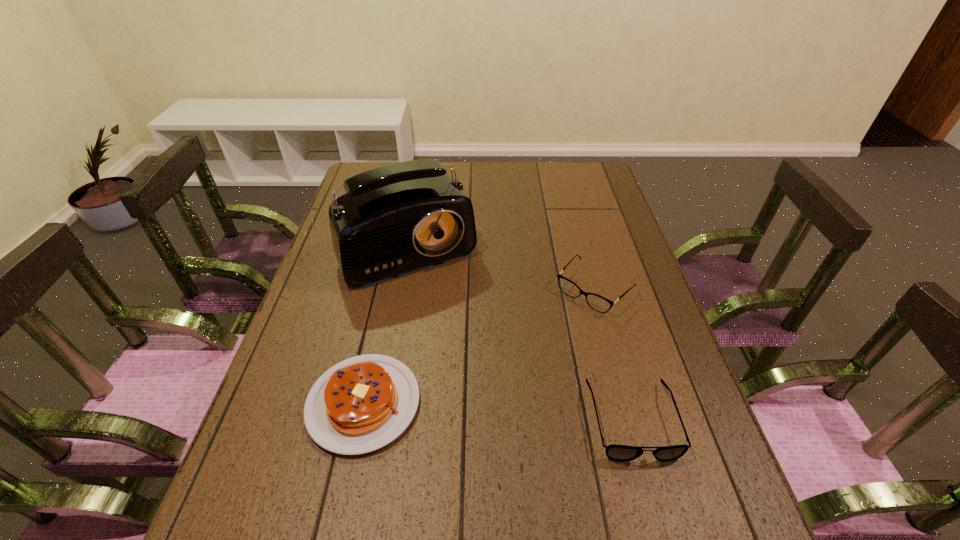
The image size is (960, 540). Identify the location of vacant region located 0.220m on the front-facing side of the farther spectacles. (524, 364).

The width and height of the screenshot is (960, 540). I want to click on pancake at the near edge, so click(x=363, y=403).

This screenshot has width=960, height=540. What are the coordinates of `spectacles at the near edge` in the screenshot? It's located at (622, 453).

Locate an element on the screen. The height and width of the screenshot is (540, 960). pancake situated at the left edge is located at coordinates (363, 403).

At what (x,y) coordinates should I click in order to perform the action: click on radio receiver positioned at the left edge. Please return your answer as a coordinate pair (x, y). The width and height of the screenshot is (960, 540). Looking at the image, I should click on (396, 219).

The image size is (960, 540). In order to click on object at the near left corner in this screenshot , I will do `click(363, 403)`.

Locate an element on the screen. The height and width of the screenshot is (540, 960). object present at the near right corner is located at coordinates (622, 453).

You are a GUI agent. You are given a task and a screenshot of the screen. Output one action in this format:
    pyautogui.click(x=<x>, y=<y>)
    Task: Click on the blank space at the far edge
    This screenshot has height=540, width=960.
    Given the screenshot: What is the action you would take?
    pyautogui.click(x=487, y=178)

Identify the location of vacant space at the near edge of the desktop. The height and width of the screenshot is (540, 960). (478, 463).

Where is `vacant space at the left edge of the desktop`? This screenshot has width=960, height=540. vacant space at the left edge of the desktop is located at coordinates (350, 292).